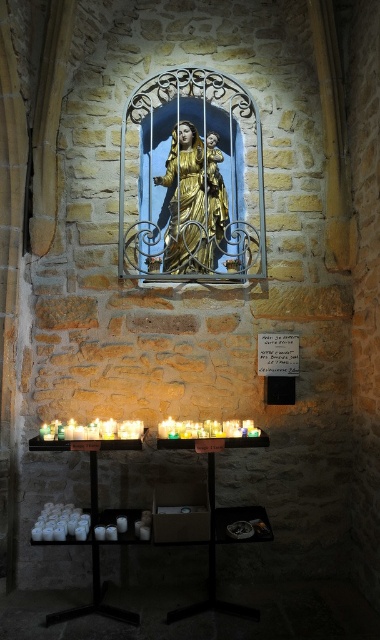
Is black matte table at lower center above gold leaf statue at center?

Actually, black matte table at lower center is below gold leaf statue at center.

What do you see at coordinates (204, 516) in the screenshot? I see `black matte table at lower center` at bounding box center [204, 516].

Is point (98, 550) farther from camera compared to point (213, 257)?

That is False.

Where is `black matte table at lower center`? The height and width of the screenshot is (640, 380). black matte table at lower center is located at coordinates (x=204, y=516).

Who is taller, gold painted glass at center or black matte table at lower center?

Standing taller between the two is gold painted glass at center.

What do you see at coordinates (191, 180) in the screenshot? This screenshot has height=640, width=380. I see `gold painted glass at center` at bounding box center [191, 180].

Locate an element on the screen. The width and height of the screenshot is (380, 640). gold painted glass at center is located at coordinates (191, 180).

Who is positioned more to the left, gold painted glass at center or gold leaf statue at center?

gold painted glass at center

Describe the element at coordinates (191, 180) in the screenshot. This screenshot has height=640, width=380. I see `gold painted glass at center` at that location.

Find the location of a particular element. gold painted glass at center is located at coordinates (191, 180).

In order to click on gold painted glass at center in this screenshot , I will do `click(191, 180)`.